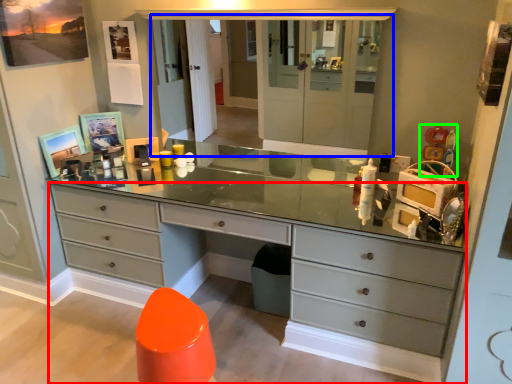
Question: Considering the real-world distances, which object is closest to chest of drawers (highlighted by a red box)? medicine cabinet (highlighted by a blue box) or toy (highlighted by a green box).

Choices:
 (A) medicine cabinet
 (B) toy

Answer: (A)